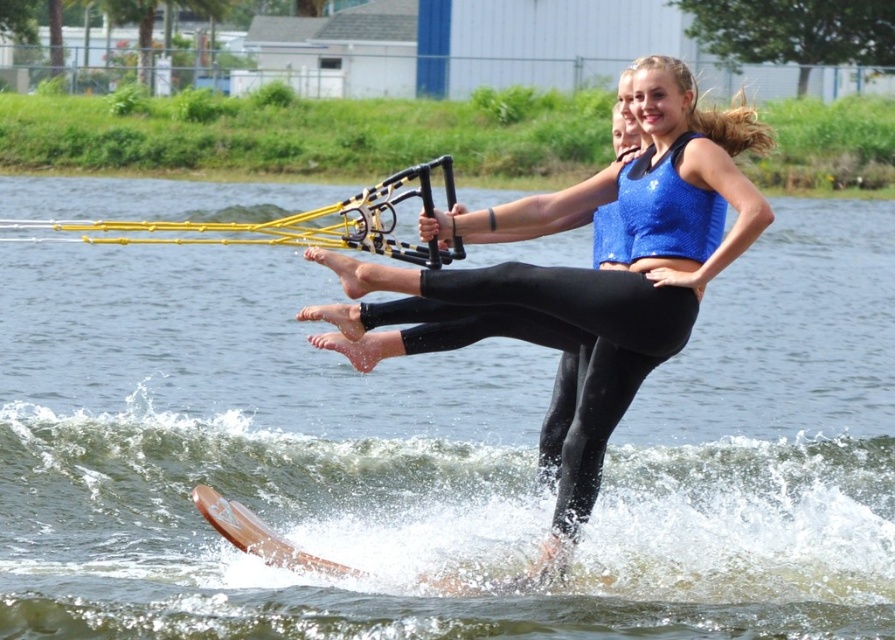
Between brown wooden water ski at center and wooden water ski at lower center, which one appears on the right side from the viewer's perspective?

From the viewer's perspective, brown wooden water ski at center appears more on the right side.

At what (x,y) coordinates should I click in order to perform the action: click on brown wooden water ski at center. Please return your answer as a coordinate pair (x, y). The height and width of the screenshot is (640, 895). Looking at the image, I should click on click(x=441, y=452).

You are a GUI agent. You are given a task and a screenshot of the screen. Output one action in this format:
    pyautogui.click(x=<x>, y=<y>)
    Task: Click on the brown wooden water ski at center
    
    Given the screenshot: What is the action you would take?
    pyautogui.click(x=441, y=452)

Who is positioned more to the right, brown wooden water ski at center or shiny blue tank top at center?

shiny blue tank top at center

Does brown wooden water ski at center appear on the right side of shiny blue tank top at center?

No, brown wooden water ski at center is not to the right of shiny blue tank top at center.

Measure the distance between point (794, 582) and camera.

42.59 meters

Where is `brown wooden water ski at center`? brown wooden water ski at center is located at coordinates (441, 452).

Does shiny blue tank top at center appear over wooden water ski at lower center?

Yes, shiny blue tank top at center is above wooden water ski at lower center.

Between shiny blue tank top at center and wooden water ski at lower center, which one has more height?

shiny blue tank top at center is taller.

Is point (631, 273) closer to viewer compared to point (271, 540)?

That is False.

Where is `shiny blue tank top at center`? The height and width of the screenshot is (640, 895). shiny blue tank top at center is located at coordinates (594, 268).